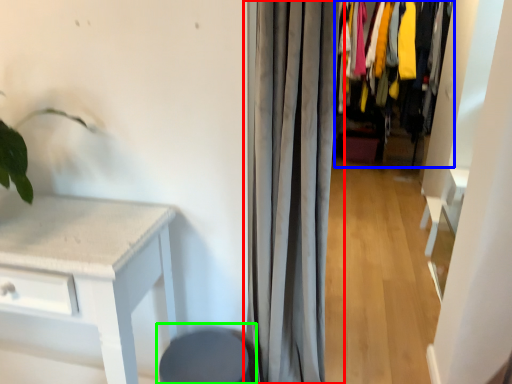
Question: Estimate the real-world distances between objects in this image. Which object is closer to curtain (highlighted by a red box), closet (highlighted by a blue box) or swivel chair (highlighted by a green box)?

Choices:
 (A) closet
 (B) swivel chair

Answer: (B)